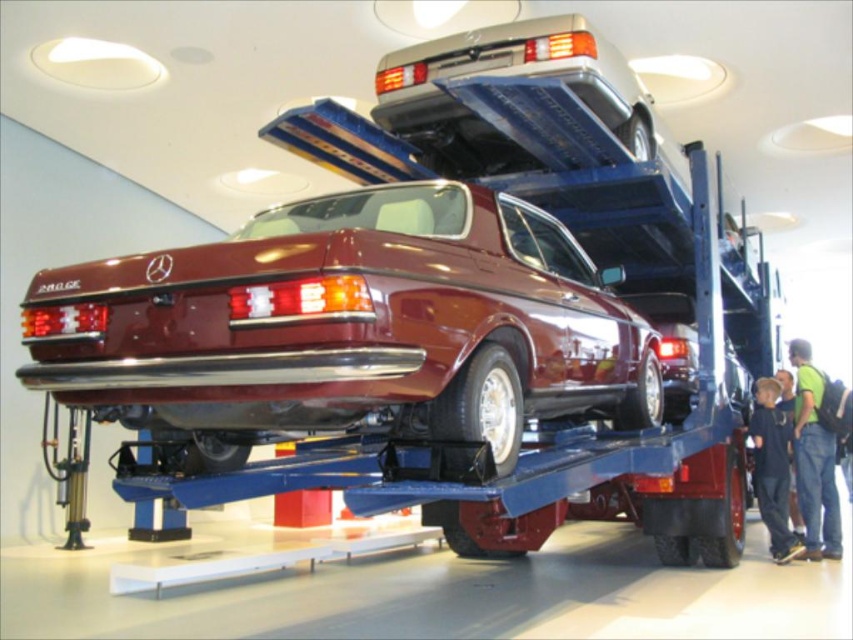
Question: Is shiny maroon car at center closer to camera compared to green fabric shirt at lower right?

Choices:
 (A) no
 (B) yes

Answer: (B)

Question: Which point is closer to the camera?

Choices:
 (A) green fabric shirt at lower right
 (B) shiny maroon car at center

Answer: (B)

Question: Can you confirm if shiny maroon car at center is positioned to the right of green fabric shirt at lower right?

Choices:
 (A) no
 (B) yes

Answer: (A)

Question: Can you confirm if shiny maroon car at center is positioned to the right of green fabric shirt at lower right?

Choices:
 (A) no
 (B) yes

Answer: (A)

Question: Which of the following is the closest to the observer?

Choices:
 (A) (808, 435)
 (B) (354, 259)

Answer: (B)